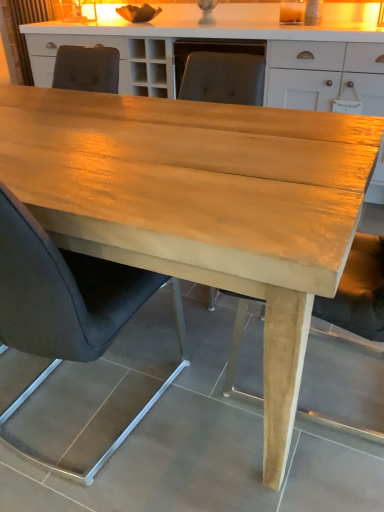
The width and height of the screenshot is (384, 512). In order to click on matte gray chair at center, the 2th chair when ordered from front to back in this screenshot , I will do `click(223, 78)`.

The height and width of the screenshot is (512, 384). I want to click on matte brown curtain at upper left, so click(20, 33).

Image resolution: width=384 pixels, height=512 pixels. What are the coordinates of `the 2nd chair directly beneath the matte brown curtain at upper left (from a real-world perspective)` in the screenshot? It's located at (66, 310).

Is black leather chair at center, marked as the second chair in a back-to-front arrangement, wider than matte brown curtain at upper left?

Indeed, black leather chair at center, marked as the second chair in a back-to-front arrangement, has a greater width compared to matte brown curtain at upper left.

Considering the sizes of objects black leather chair at center, marked as the second chair in a back-to-front arrangement, and matte brown curtain at upper left in the image provided, who is taller, black leather chair at center, marked as the second chair in a back-to-front arrangement, or matte brown curtain at upper left?

With more height is black leather chair at center, marked as the second chair in a back-to-front arrangement.

Is the position of black leather chair at center, marked as the second chair in a back-to-front arrangement, less distant than that of matte brown curtain at upper left?

That is True.

Considering the positions of objects black leather chair at center, marked as the first chair in a front-to-back arrangement, and matte gray chair at center, the first chair viewed from the back, in the image provided, who is in front, black leather chair at center, marked as the first chair in a front-to-back arrangement, or matte gray chair at center, the first chair viewed from the back,?

Positioned in front is black leather chair at center, marked as the first chair in a front-to-back arrangement.

Is black leather chair at center, marked as the second chair in a back-to-front arrangement, thinner than matte gray chair at center, the first chair viewed from the back?

Yes, black leather chair at center, marked as the second chair in a back-to-front arrangement, is thinner than matte gray chair at center, the first chair viewed from the back.

Consider the image. Does black leather chair at center, marked as the second chair in a back-to-front arrangement, contain matte gray chair at center, the 2th chair when ordered from front to back?

No, matte gray chair at center, the 2th chair when ordered from front to back, is not surrounded by black leather chair at center, marked as the second chair in a back-to-front arrangement.

Is point (5, 330) closer to viewer compared to point (192, 68)?

Yes.

Is matte gray chair at center, the first chair viewed from the back, bigger or smaller than matte brown curtain at upper left?

Considering their sizes, matte gray chair at center, the first chair viewed from the back, takes up more space than matte brown curtain at upper left.

Which is in front, point (210, 291) or point (10, 27)?

The point (210, 291) is closer.

Would you say matte gray chair at center, the 2th chair when ordered from front to back, is outside matte brown curtain at upper left?

matte gray chair at center, the 2th chair when ordered from front to back, lies outside matte brown curtain at upper left's area.

Is matte gray chair at center, the first chair viewed from the back, to the left of matte brown curtain at upper left from the viewer's perspective?

In fact, matte gray chair at center, the first chair viewed from the back, is to the right of matte brown curtain at upper left.

From a real-world perspective, is matte brown curtain at upper left located beneath black leather chair at center, marked as the first chair in a front-to-back arrangement?

No, from a real-world perspective, matte brown curtain at upper left is not below black leather chair at center, marked as the first chair in a front-to-back arrangement.

Who is smaller, matte brown curtain at upper left or black leather chair at center, marked as the second chair in a back-to-front arrangement?

matte brown curtain at upper left is smaller.

Between matte brown curtain at upper left and black leather chair at center, marked as the first chair in a front-to-back arrangement, which one appears on the right side from the viewer's perspective?

black leather chair at center, marked as the first chair in a front-to-back arrangement, is more to the right.

Is matte brown curtain at upper left oriented away from black leather chair at center, marked as the first chair in a front-to-back arrangement?

No, black leather chair at center, marked as the first chair in a front-to-back arrangement, is not at the back of matte brown curtain at upper left.

Is matte gray chair at center, the 2th chair when ordered from front to back, facing towards black leather chair at center, marked as the first chair in a front-to-back arrangement?

Yes, matte gray chair at center, the 2th chair when ordered from front to back, is facing black leather chair at center, marked as the first chair in a front-to-back arrangement.

Looking at this image, from the image's perspective, is matte gray chair at center, the first chair viewed from the back, on black leather chair at center, marked as the first chair in a front-to-back arrangement?

Yes, from the image's perspective, matte gray chair at center, the first chair viewed from the back, is on top of black leather chair at center, marked as the first chair in a front-to-back arrangement.

Would you say matte gray chair at center, the 2th chair when ordered from front to back, is a long distance from black leather chair at center, marked as the second chair in a back-to-front arrangement?

Yes, matte gray chair at center, the 2th chair when ordered from front to back, and black leather chair at center, marked as the second chair in a back-to-front arrangement, are located far from each other.

Identify the location of chair that appears above the black leather chair at center, marked as the first chair in a front-to-back arrangement (from the image's perspective). (223, 78).

Is matte brown curtain at upper left in front of matte gray chair at center, the 2th chair when ordered from front to back?

No, it is not.

Looking at the image, does matte brown curtain at upper left seem bigger or smaller compared to matte gray chair at center, the first chair viewed from the back?

matte brown curtain at upper left is smaller than matte gray chair at center, the first chair viewed from the back.

Between matte brown curtain at upper left and matte gray chair at center, the 2th chair when ordered from front to back, which one has more height?

Standing taller between the two is matte gray chair at center, the 2th chair when ordered from front to back.

Based on the photo, from the image's perspective, would you say matte brown curtain at upper left is positioned over matte gray chair at center, the first chair viewed from the back?

Correct, matte brown curtain at upper left appears higher than matte gray chair at center, the first chair viewed from the back, in the image.

The height and width of the screenshot is (512, 384). Identify the location of curtain above the black leather chair at center, marked as the second chair in a back-to-front arrangement (from a real-world perspective). (20, 33).

Where is `chair that appears behind the black leather chair at center, marked as the first chair in a front-to-back arrangement`? chair that appears behind the black leather chair at center, marked as the first chair in a front-to-back arrangement is located at coordinates (223, 78).

Which object lies further to the anchor point matte gray chair at center, the first chair viewed from the back, black leather chair at center, marked as the first chair in a front-to-back arrangement, or matte brown curtain at upper left?

Among the two, matte brown curtain at upper left is located further to matte gray chair at center, the first chair viewed from the back.

Estimate the real-world distances between objects in this image. Which object is further from black leather chair at center, marked as the second chair in a back-to-front arrangement, matte brown curtain at upper left or matte gray chair at center, the 2th chair when ordered from front to back?

The object further to black leather chair at center, marked as the second chair in a back-to-front arrangement, is matte brown curtain at upper left.

From the image, which object appears to be nearer to black leather chair at center, marked as the first chair in a front-to-back arrangement, matte gray chair at center, the first chair viewed from the back, or matte brown curtain at upper left?

Among the two, matte gray chair at center, the first chair viewed from the back, is located nearer to black leather chair at center, marked as the first chair in a front-to-back arrangement.

Considering their positions, is black leather chair at center, marked as the first chair in a front-to-back arrangement, positioned further to matte brown curtain at upper left than matte gray chair at center, the first chair viewed from the back?

black leather chair at center, marked as the first chair in a front-to-back arrangement.

Based on their spatial positions, is matte brown curtain at upper left or black leather chair at center, marked as the first chair in a front-to-back arrangement, closer to matte gray chair at center, the first chair viewed from the back?

black leather chair at center, marked as the first chair in a front-to-back arrangement, is positioned closer to the anchor matte gray chair at center, the first chair viewed from the back.

Considering their positions, is matte gray chair at center, the 2th chair when ordered from front to back, positioned further to matte brown curtain at upper left than black leather chair at center, marked as the first chair in a front-to-back arrangement?

black leather chair at center, marked as the first chair in a front-to-back arrangement.

I want to click on chair between black leather chair at center, marked as the second chair in a back-to-front arrangement, and matte brown curtain at upper left, along the z-axis, so click(x=223, y=78).